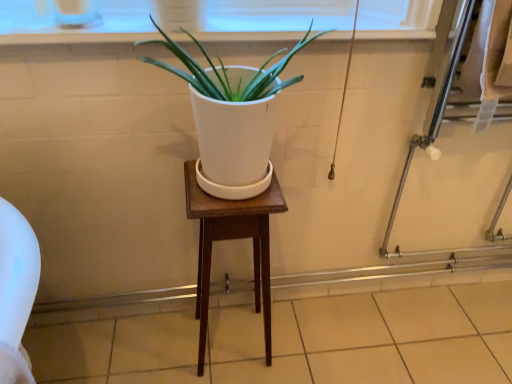
Find the location of `vacant space underneath wooden stool at center (from a real-world perspective)`. vacant space underneath wooden stool at center (from a real-world perspective) is located at coordinates (233, 346).